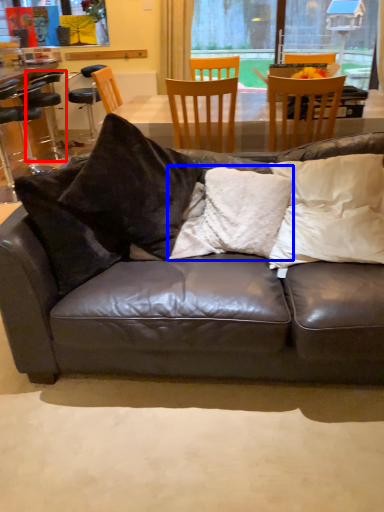
Question: Which object is further to the camera taking this photo, bar stool (highlighted by a red box) or pillow (highlighted by a blue box)?

Choices:
 (A) bar stool
 (B) pillow

Answer: (A)